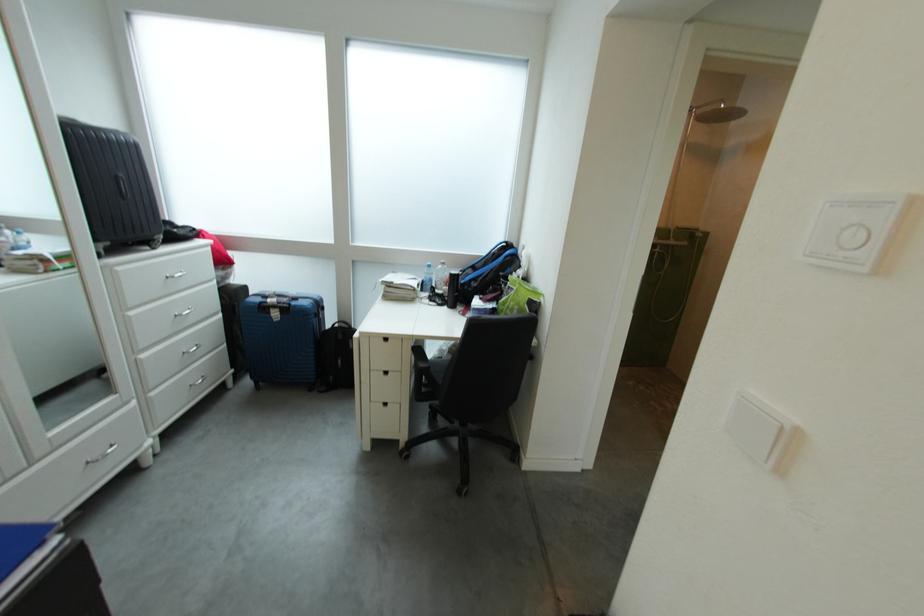
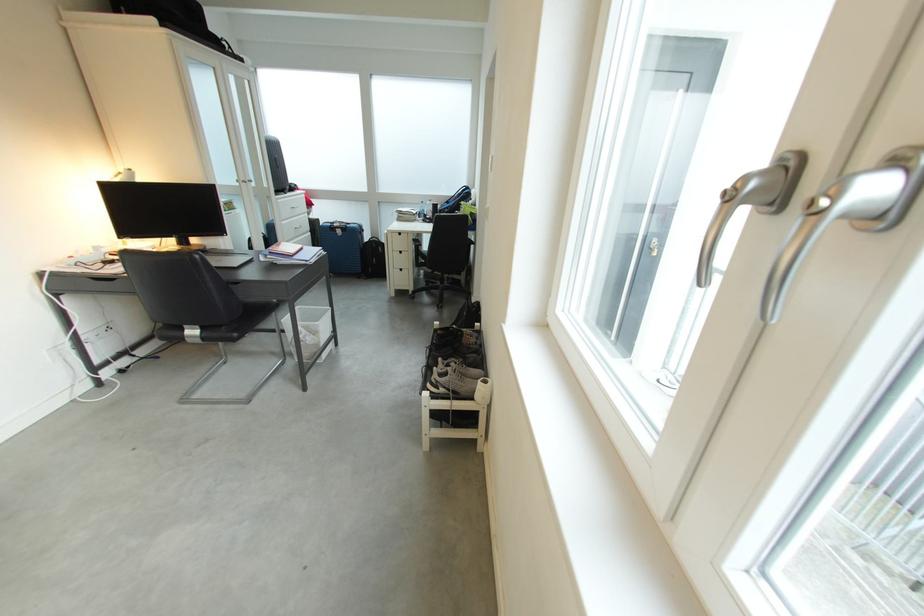
Locate, in the second image, the point that corresponds to (x=286, y=317) in the first image.

(350, 235)